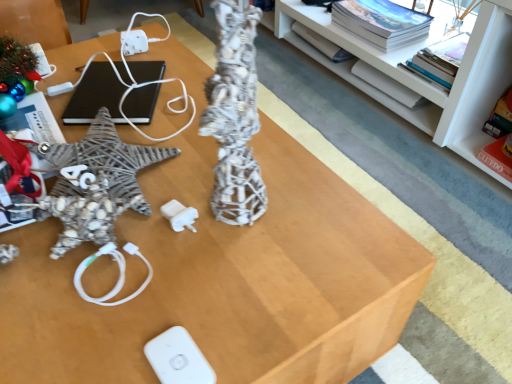
Identify the location of vacant area located to the right-hand side of shiny metallic ornament at upper left. The height and width of the screenshot is (384, 512). (68, 76).